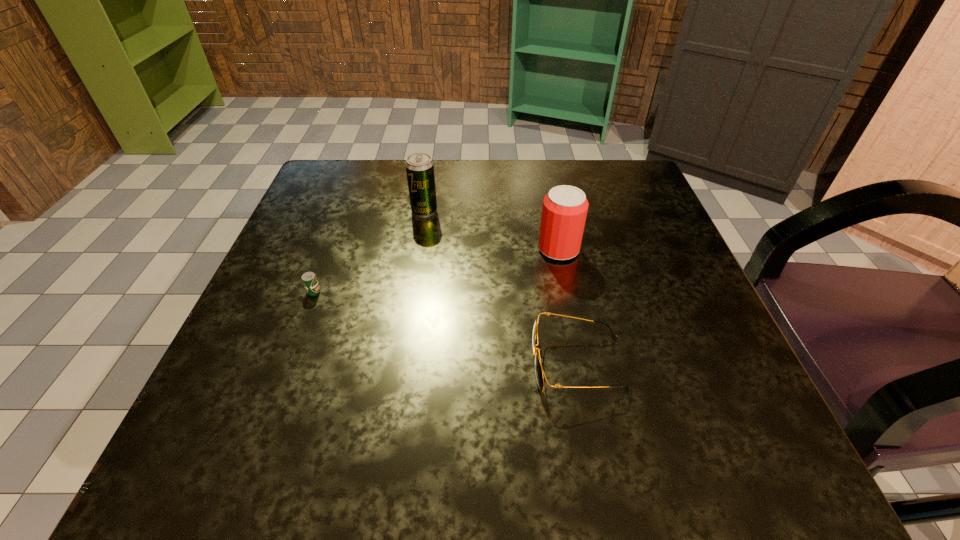
Image resolution: width=960 pixels, height=540 pixels. Identify the location of free spot at the right edge of the desktop. (693, 334).

Identify the location of vacant space at the far left corner of the desktop. This screenshot has height=540, width=960. (362, 179).

In the image, there is a desktop. What are the coordinates of `vacant space at the far right corner` in the screenshot? It's located at (621, 182).

The height and width of the screenshot is (540, 960). What are the coordinates of `free space at the near right corner of the desktop` in the screenshot? It's located at (710, 480).

I want to click on vacant area that lies between the third farthest object and the farthest beer can, so click(369, 251).

In order to click on free point between the third tallest object and the second farthest beer can in this screenshot , I will do `click(568, 306)`.

This screenshot has width=960, height=540. I want to click on free point between the third tallest object and the farthest beer can, so click(x=501, y=287).

At what (x,y) coordinates should I click in order to perform the action: click on free space between the nearest beer can and the second shortest object. Please return your answer as a coordinate pair (x, y). Image resolution: width=960 pixels, height=540 pixels. Looking at the image, I should click on (445, 327).

The width and height of the screenshot is (960, 540). What are the coordinates of `blank region between the shortest object and the farthest beer can` in the screenshot? It's located at (369, 251).

The image size is (960, 540). I want to click on vacant area that lies between the leftmost beer can and the third object from right to left, so click(369, 251).